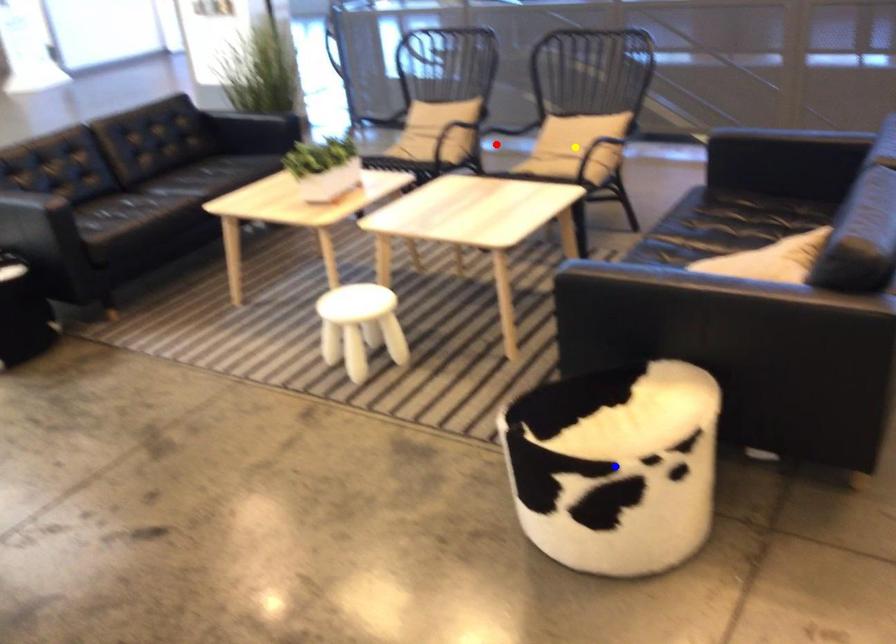
Order these from nearest to farthest:
blue point
yellow point
red point

1. blue point
2. yellow point
3. red point